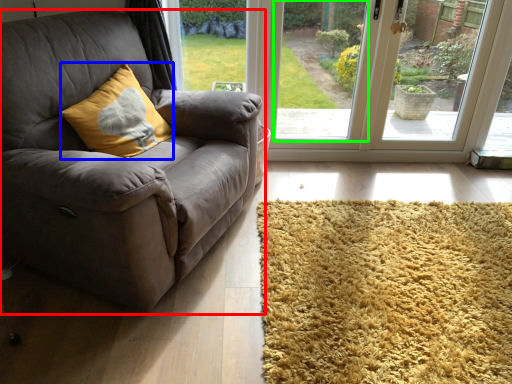
Question: Estimate the real-world distances between objects in this image. Which object is closer to studio couch (highlighted by a red box), throw pillow (highlighted by a blue box) or window screen (highlighted by a green box)?

Choices:
 (A) throw pillow
 (B) window screen

Answer: (A)